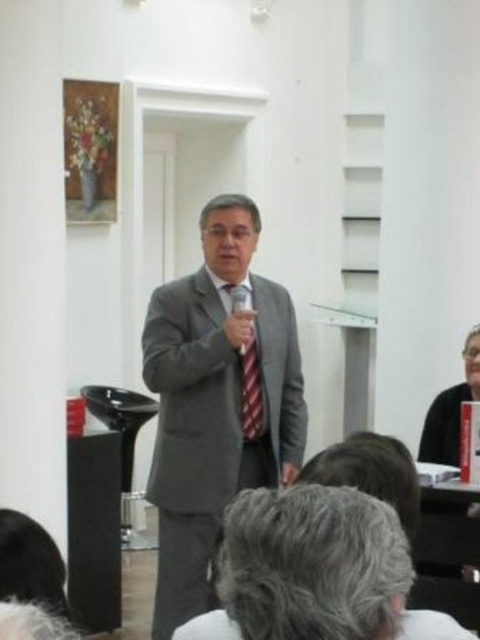
You are an event planner organizing a formal event. You need to ensure that the speaker in the image is appropriately dressed for the occasion. Based on the description, does the matte gray suit at center and the red striped tie at center align with the formal dress code?

The matte gray suit at center is positioned on the left side of red striped tie at center, which indicates that the speaker is wearing both items together. A gray suit paired with a red striped tie is appropriate for a formal event as it maintains a professional yet stylish appearance.

You are a photographer adjusting the camera focus. You need to ensure both the gray hair at lower center and the black fabric at lower right are in focus. Which object should you focus on first to account for their relative heights?

Since the gray hair at lower center is not as tall as the black fabric at lower right, you should focus on the gray hair at lower center first to ensure depth of field covers both objects.

You are standing at the point with coordinates [216,403] in the image. What object are you currently standing on?

You are standing on the matte gray suit at center.